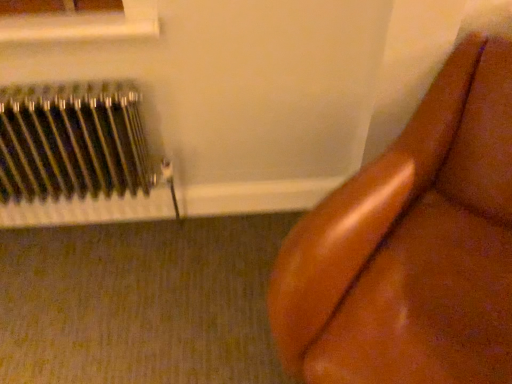
Image resolution: width=512 pixels, height=384 pixels. What do you see at coordinates (79, 156) in the screenshot?
I see `metallic silver radiator at left` at bounding box center [79, 156].

This screenshot has height=384, width=512. Find the location of `brown leather couch at right`. brown leather couch at right is located at coordinates (412, 247).

This screenshot has width=512, height=384. I want to click on white plastic window frame at upper left, so click(x=84, y=24).

Is brown leather couch at right oriented away from white plastic window frame at upper left?

brown leather couch at right is not turned away from white plastic window frame at upper left.

Which object is positioned more to the right, brown leather couch at right or white plastic window frame at upper left?

brown leather couch at right is more to the right.

Considering the sizes of objects brown leather couch at right and white plastic window frame at upper left in the image provided, who is bigger, brown leather couch at right or white plastic window frame at upper left?

With larger size is brown leather couch at right.

Is metallic silver radiator at left touching white plastic window frame at upper left?

metallic silver radiator at left and white plastic window frame at upper left are not in contact.

At what (x,y) coordinates should I click in order to perform the action: click on radiator behind the white plastic window frame at upper left. Please return your answer as a coordinate pair (x, y). This screenshot has width=512, height=384. Looking at the image, I should click on (79, 156).

What's the angular difference between metallic silver radiator at left and white plastic window frame at upper left's facing directions?

The angle between the facing direction of metallic silver radiator at left and the facing direction of white plastic window frame at upper left is 0.34 degrees.

Choose the correct answer: Is metallic silver radiator at left inside white plastic window frame at upper left or outside it?

metallic silver radiator at left is located beyond the bounds of white plastic window frame at upper left.

Looking at this image, is metallic silver radiator at left to the right of brown leather couch at right from the viewer's perspective?

In fact, metallic silver radiator at left is to the left of brown leather couch at right.

Which of these two, metallic silver radiator at left or brown leather couch at right, stands taller?

brown leather couch at right is taller.

Is metallic silver radiator at left directly adjacent to brown leather couch at right?

metallic silver radiator at left and brown leather couch at right are not in contact.

From the image's perspective, is brown leather couch at right beneath metallic silver radiator at left?

Indeed, from the image's perspective, brown leather couch at right is shown beneath metallic silver radiator at left.

Is brown leather couch at right taller than metallic silver radiator at left?

Yes, brown leather couch at right is taller than metallic silver radiator at left.

Relative to metallic silver radiator at left, is brown leather couch at right in front or behind?

In the image, brown leather couch at right appears in front of metallic silver radiator at left.

Are white plastic window frame at upper left and brown leather couch at right making contact?

No, white plastic window frame at upper left is not making contact with brown leather couch at right.

Considering the relative sizes of white plastic window frame at upper left and brown leather couch at right in the image provided, is white plastic window frame at upper left thinner than brown leather couch at right?

Yes.

Is brown leather couch at right located within white plastic window frame at upper left?

No, brown leather couch at right is located outside of white plastic window frame at upper left.

Locate an element on the screen. window frame above the brown leather couch at right (from a real-world perspective) is located at coordinates (84, 24).

From the image's perspective, is white plastic window frame at upper left below metallic silver radiator at left?

Incorrect, from the image's perspective, white plastic window frame at upper left is higher than metallic silver radiator at left.

Is white plastic window frame at upper left taller than metallic silver radiator at left?

In fact, white plastic window frame at upper left may be shorter than metallic silver radiator at left.

Considering the positions of point (57, 16) and point (18, 166), is point (57, 16) closer or farther from the camera than point (18, 166)?

Clearly, point (57, 16) is closer to the camera than point (18, 166).

From a real-world perspective, is white plastic window frame at upper left positioned above or below metallic silver radiator at left?

Clearly, from a real-world perspective, white plastic window frame at upper left is above metallic silver radiator at left.

I want to click on window frame above the brown leather couch at right (from the image's perspective), so click(84, 24).

Identify the location of radiator below the white plastic window frame at upper left (from a real-world perspective). (79, 156).

From the image, which object appears to be farther from white plastic window frame at upper left, brown leather couch at right or metallic silver radiator at left?

brown leather couch at right is further to white plastic window frame at upper left.

Considering their positions, is brown leather couch at right positioned further to metallic silver radiator at left than white plastic window frame at upper left?

The object further to metallic silver radiator at left is brown leather couch at right.

From the image, which object appears to be nearer to white plastic window frame at upper left, metallic silver radiator at left or brown leather couch at right?

Based on the image, metallic silver radiator at left appears to be nearer to white plastic window frame at upper left.

From the image, which object appears to be farther from metallic silver radiator at left, white plastic window frame at upper left or brown leather couch at right?

Based on the image, brown leather couch at right appears to be further to metallic silver radiator at left.

From the image, which object appears to be nearer to brown leather couch at right, metallic silver radiator at left or white plastic window frame at upper left?

Among the two, metallic silver radiator at left is located nearer to brown leather couch at right.

Which object lies nearer to the anchor point brown leather couch at right, white plastic window frame at upper left or metallic silver radiator at left?

Among the two, metallic silver radiator at left is located nearer to brown leather couch at right.

The width and height of the screenshot is (512, 384). Find the location of `window frame located between metallic silver radiator at left and brown leather couch at right in the left-right direction`. window frame located between metallic silver radiator at left and brown leather couch at right in the left-right direction is located at coordinates (84, 24).